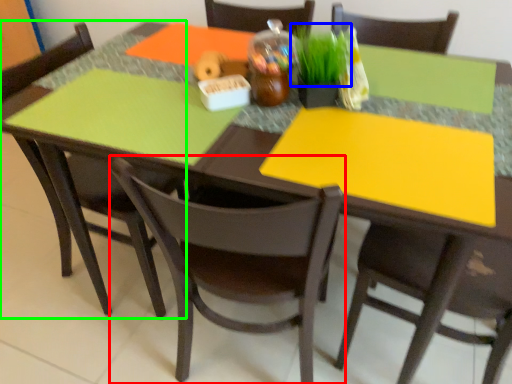
Question: Which object is the farthest from chair (highlighted by a red box)? Choose among these: grass (highlighted by a blue box) or chair (highlighted by a green box).

Choices:
 (A) grass
 (B) chair

Answer: (A)